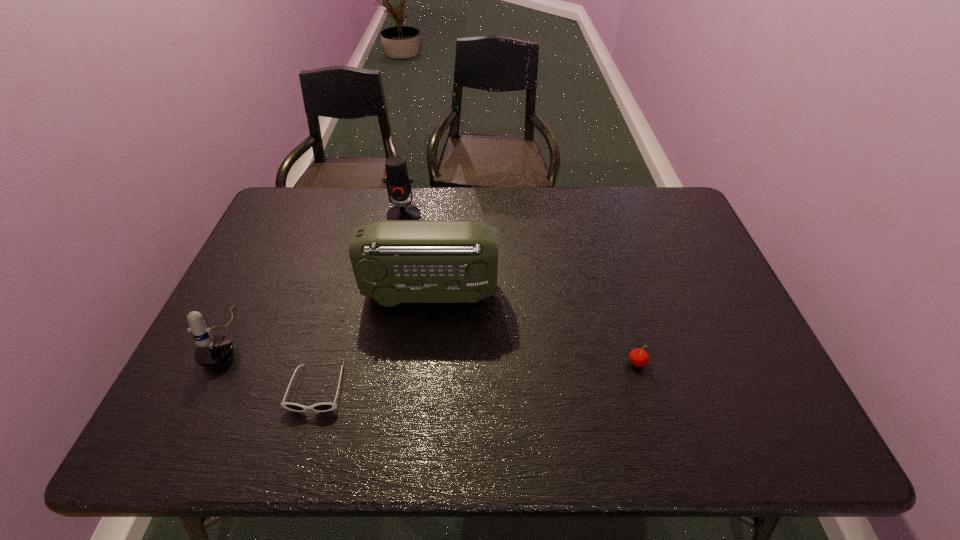
This screenshot has height=540, width=960. In order to click on empty space that is in between the rightmost object and the nearer microphone in this screenshot , I will do click(433, 349).

Where is `free spot between the radio_receiver and the fourth tallest object`? This screenshot has height=540, width=960. free spot between the radio_receiver and the fourth tallest object is located at coordinates (534, 327).

Identify which object is located as the fourth nearest to the radio_receiver. Please provide its 2D coordinates. Your answer should be formatted as a tuple, i.e. [(x, y)], where the tuple contains the x and y coordinates of a point satisfying the conditions above.

[(638, 357)]

In order to click on object that ranks as the second closest to the sunglasses in this screenshot , I will do `click(394, 261)`.

The width and height of the screenshot is (960, 540). I want to click on free space in the image that satisfies the following two spatial constraints: 1. on the front-facing side of the radio_receiver; 2. with the lenses of the shortest object facing outward, so click(x=420, y=389).

The width and height of the screenshot is (960, 540). What are the coordinates of `free space in the image that satisfies the following two spatial constraints: 1. on the side of the right microphone with the red ring; 2. on the left side of the cherry` in the screenshot? It's located at (376, 362).

Identify the location of blank space that satisfies the following two spatial constraints: 1. on the side of the rightmost object with the red ring; 2. on the right side of the taller microphone. The width and height of the screenshot is (960, 540). (376, 362).